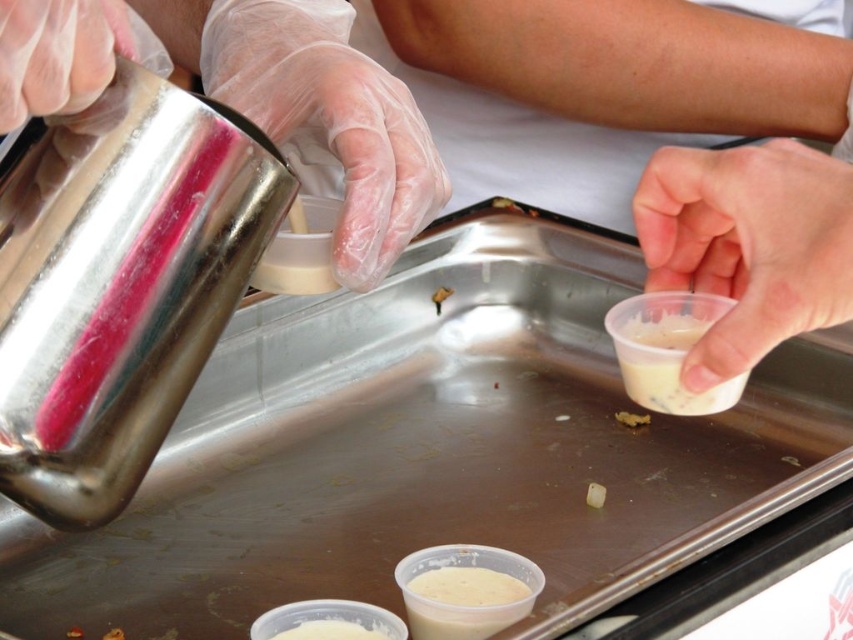
Question: Can you confirm if white creamy substance at lower center is thinner than white matte cube at center?

Choices:
 (A) no
 (B) yes

Answer: (A)

Question: Can you confirm if transparent plastic cup at upper right is smaller than white creamy substance at lower center?

Choices:
 (A) no
 (B) yes

Answer: (A)

Question: Which of the following is the closest to the observer?

Choices:
 (A) (260, 120)
 (B) (601, 492)
 (C) (305, 627)

Answer: (C)

Question: Considering the real-world distances, which object is farthest from the white matte cube at center?

Choices:
 (A) transparent plastic cup at upper right
 (B) white creamy substance at lower center

Answer: (A)

Question: Can you confirm if transparent plastic cup at upper right is positioned above white creamy substance at lower center?

Choices:
 (A) yes
 (B) no

Answer: (A)

Question: Which of the following is the closest to the observer?

Choices:
 (A) white matte cube at center
 (B) white creamy substance at lower center
 (C) transparent plastic cup at upper right

Answer: (C)